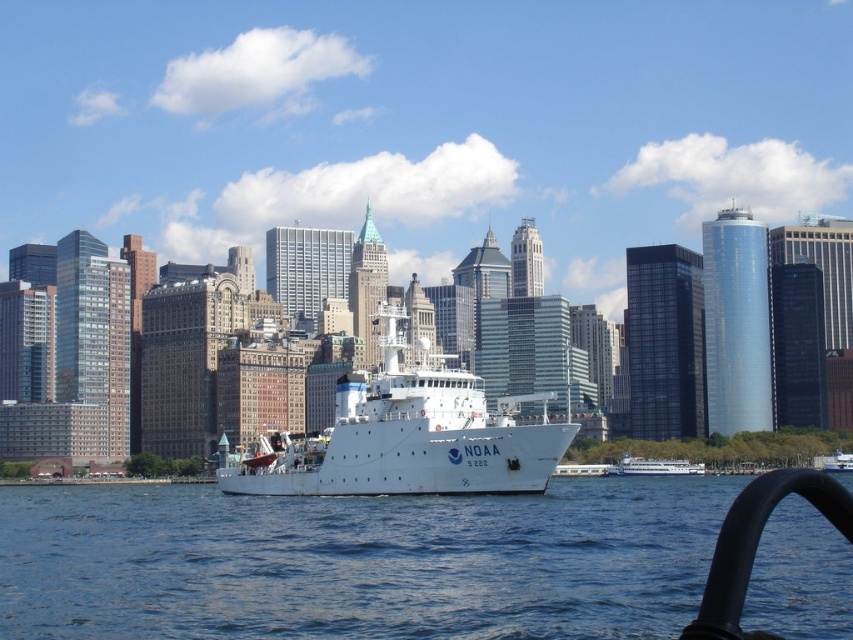
Question: Considering the relative positions of blue water at center and white glossy ferry at center in the image provided, where is blue water at center located with respect to white glossy ferry at center?

Choices:
 (A) above
 (B) below

Answer: (A)

Question: Which object is the closest to the white glossy ferry at center?

Choices:
 (A) white matte ship at center
 (B) blue water at center

Answer: (A)

Question: Is blue water at center positioned before white matte ship at center?

Choices:
 (A) no
 (B) yes

Answer: (B)

Question: Among these objects, which one is farthest from the camera?

Choices:
 (A) blue water at center
 (B) white glossy ferry at center

Answer: (B)

Question: Where is white matte ship at center located in relation to white glossy ferry at center in the image?

Choices:
 (A) below
 (B) above

Answer: (B)

Question: Which of these objects is positioned closest to the blue water at center?

Choices:
 (A) white glossy ferry at center
 (B) white matte ship at center

Answer: (B)